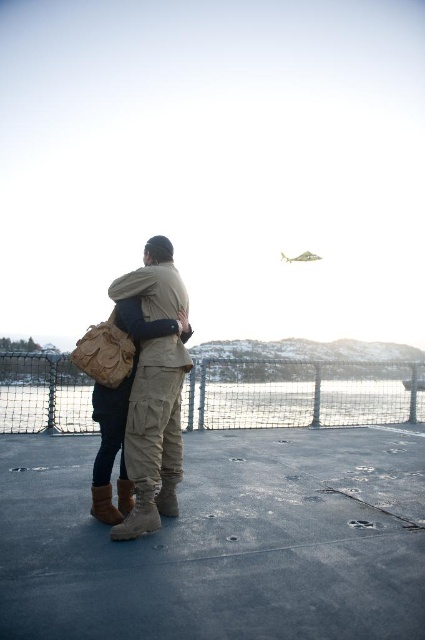
Question: Is wire mesh fence at center closer to camera compared to camouflage cargo pants at center?

Choices:
 (A) yes
 (B) no

Answer: (B)

Question: Which point is farther from the camera taking this photo?

Choices:
 (A) (237, 401)
 (B) (176, 404)

Answer: (A)

Question: Is wire mesh fence at center wider than camouflage cargo pants at center?

Choices:
 (A) no
 (B) yes

Answer: (B)

Question: Which point is farther to the camera?

Choices:
 (A) wire mesh fence at center
 (B) camouflage cargo pants at center

Answer: (A)

Question: Does wire mesh fence at center have a larger size compared to camouflage cargo pants at center?

Choices:
 (A) yes
 (B) no

Answer: (A)

Question: Which point is farther to the camera?

Choices:
 (A) (326, 364)
 (B) (139, 460)

Answer: (A)